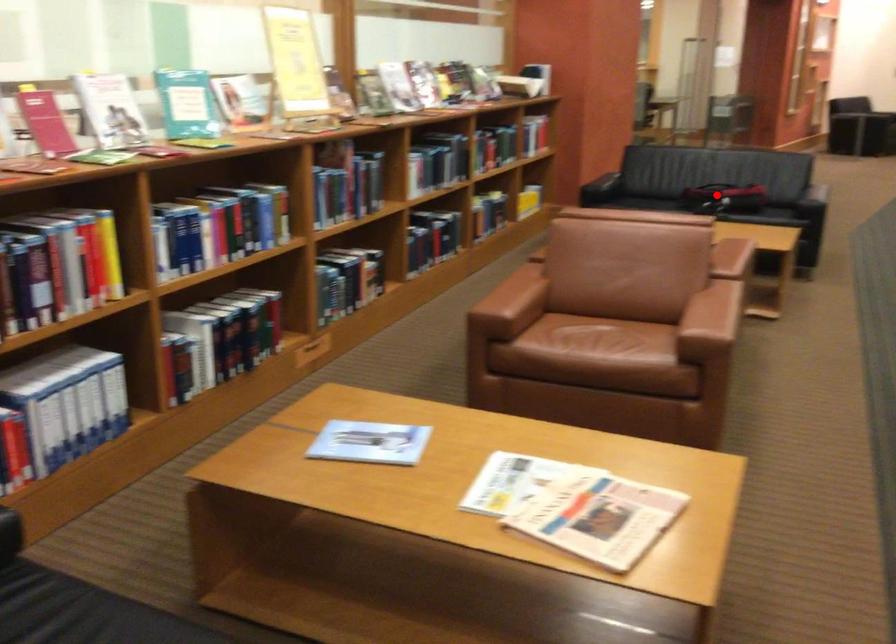
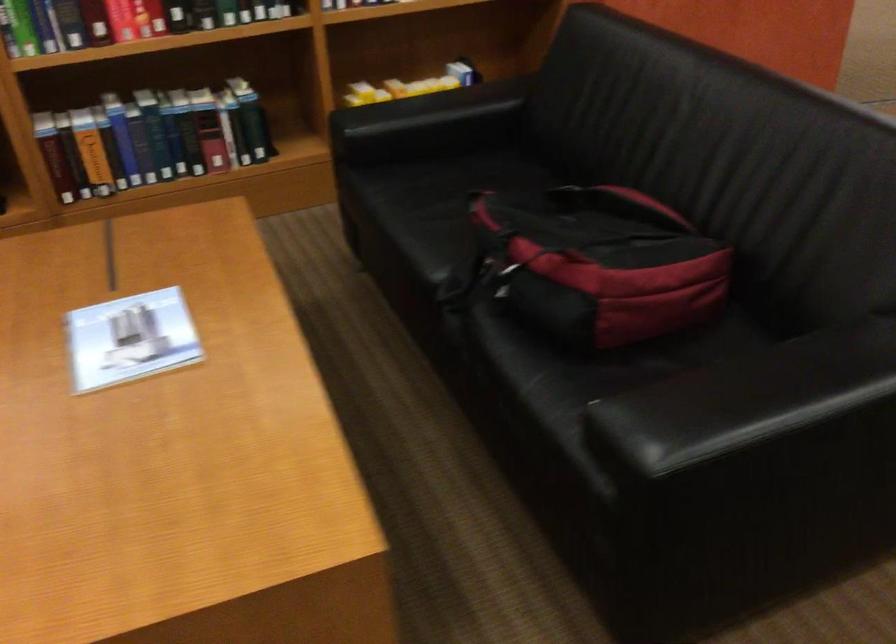
Question: I am providing you with two images of the same scene from different viewpoints. A red point is shown in image1. For the corresponding object point in image2, is it positioned nearer or farther from the camera?

Choices:
 (A) Nearer
 (B) Farther

Answer: (A)